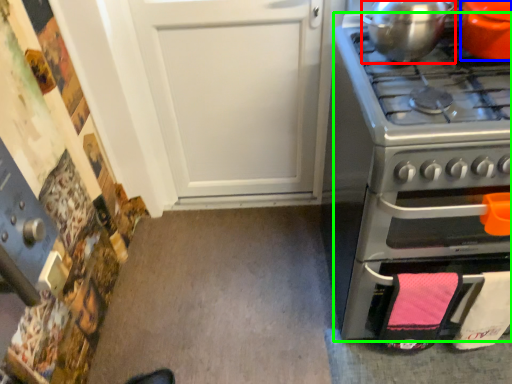
Question: Which is farther away from kitchen appliance (highlighted by a red box)? kitchen appliance (highlighted by a blue box) or oven (highlighted by a green box)?

Choices:
 (A) kitchen appliance
 (B) oven

Answer: (B)